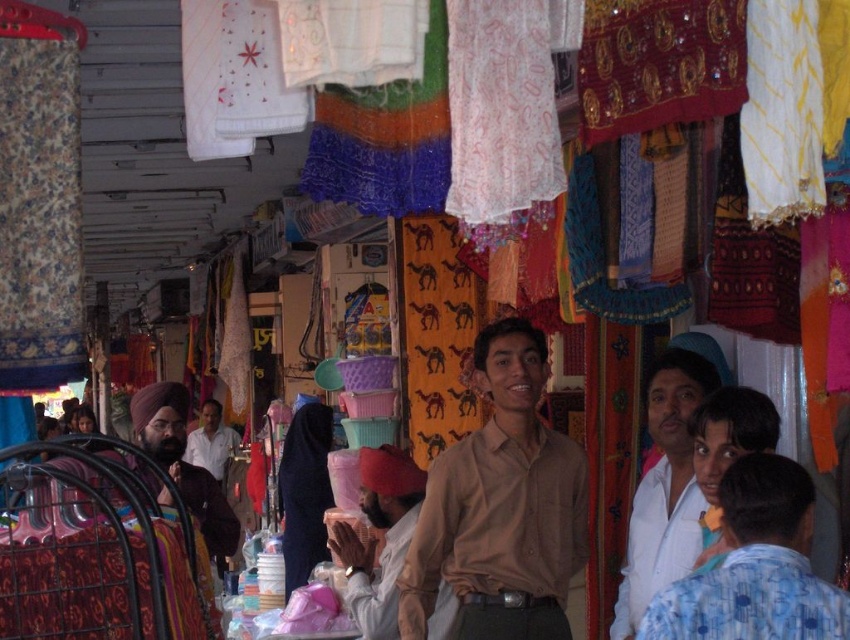
Question: Is brown cotton shirt at center to the right of light brown shirt at center from the viewer's perspective?

Choices:
 (A) no
 (B) yes

Answer: (B)

Question: Which object is positioned closest to the light blue printed shirt at center?

Choices:
 (A) light brown cotton shirt at center
 (B) brown cotton shirt at center

Answer: (B)

Question: Is matte brown turban at left further to the viewer compared to light brown shirt at center?

Choices:
 (A) yes
 (B) no

Answer: (B)

Question: Among these objects, which one is nearest to the camera?

Choices:
 (A) light brown cotton shirt at center
 (B) light brown shirt at center

Answer: (A)

Question: Can you confirm if light blue printed shirt at center is thinner than matte brown turban at left?

Choices:
 (A) yes
 (B) no

Answer: (A)

Question: Which is nearer to the light brown cotton shirt at center?

Choices:
 (A) light blue printed shirt at center
 (B) light brown shirt at center
 (C) brown cotton shirt at center

Answer: (C)